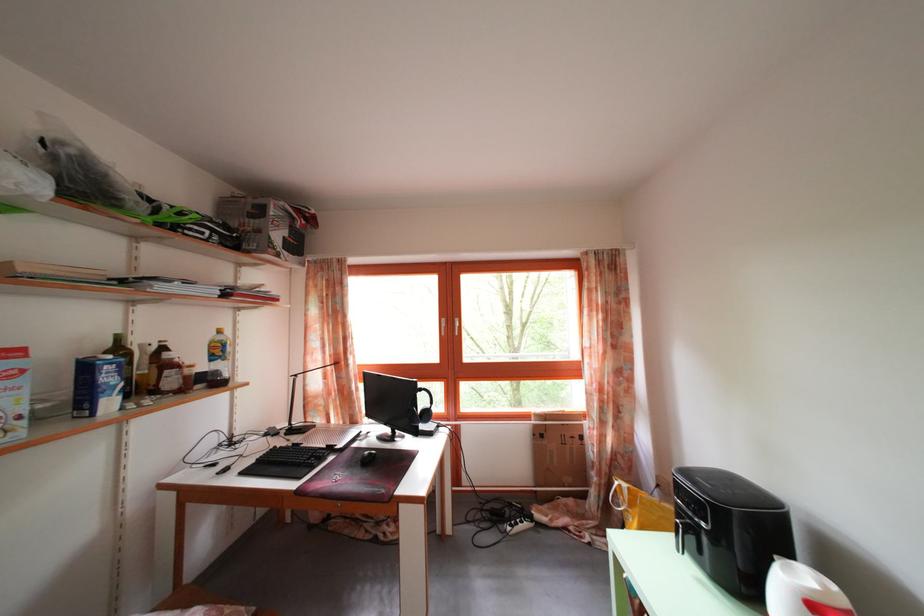
The image size is (924, 616). Identify the location of green glass bottle. (123, 362).